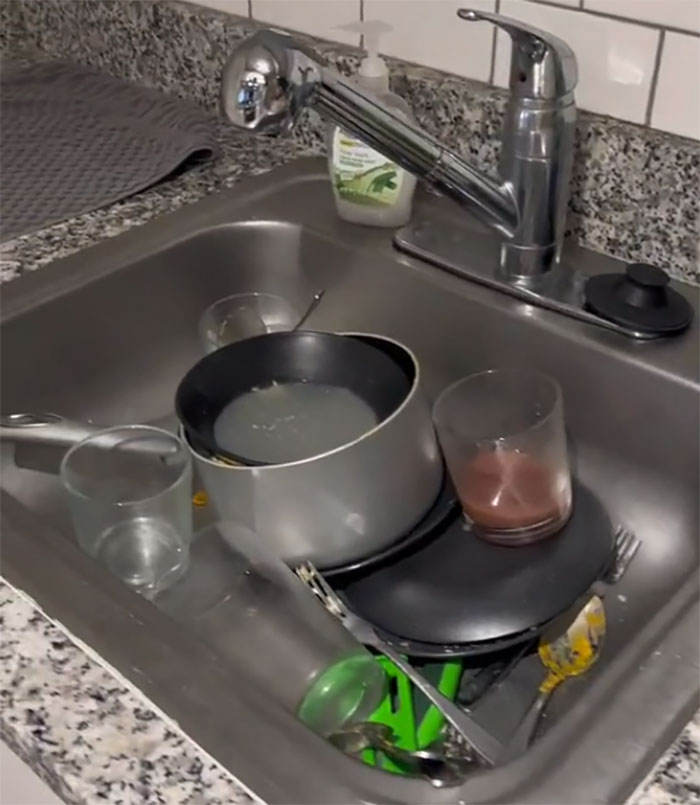
Image resolution: width=700 pixels, height=805 pixels. In order to click on towel in this screenshot , I will do `click(89, 120)`.